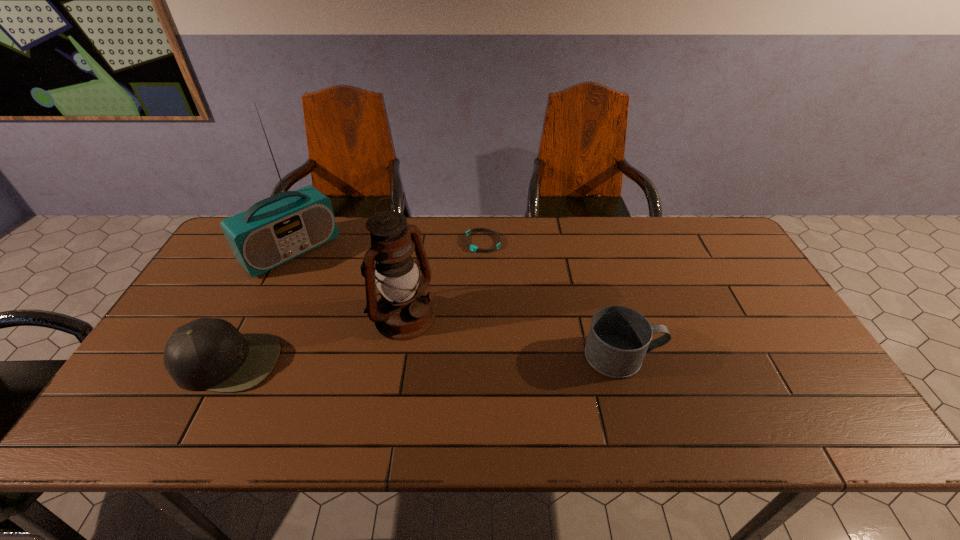
At what (x,y) coordinates should I click in order to perform the action: click on object that can be found as the fourth closest to the radio receiver. Please return your answer as a coordinate pair (x, y). Looking at the image, I should click on (619, 338).

Locate which object is the second closest to the lantern. Please provide its 2D coordinates. Your answer should be formatted as a tuple, i.e. [(x, y)], where the tuple contains the x and y coordinates of a point satisfying the conditions above.

[(473, 248)]

At what (x,y) coordinates should I click in order to perform the action: click on vacant area in the image that satisfies the following two spatial constraints: 1. on the back side of the shortest object; 2. on the right side of the third object from left to right. Please return your answer as a coordinate pair (x, y). This screenshot has height=540, width=960. Looking at the image, I should click on point(417,242).

You are a GUI agent. You are given a task and a screenshot of the screen. Output one action in this format:
    pyautogui.click(x=<x>, y=<y>)
    Task: Click on the vacant region that satisfies the following two spatial constraints: 1. on the front side of the third object from left to right; 2. on the side of the mug with the handle
    
    Given the screenshot: What is the action you would take?
    pyautogui.click(x=398, y=356)